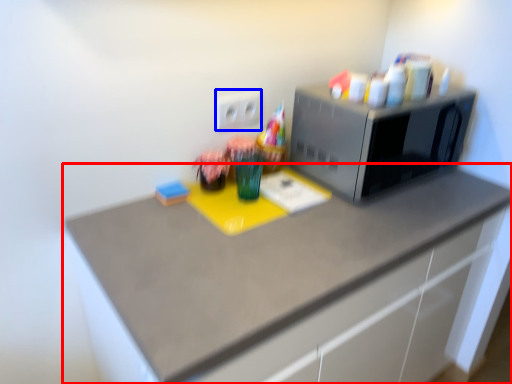
Question: Which of the following is the closest to the observer, countertop (highlighted by a red box) or electric outlet (highlighted by a blue box)?

Choices:
 (A) countertop
 (B) electric outlet

Answer: (A)